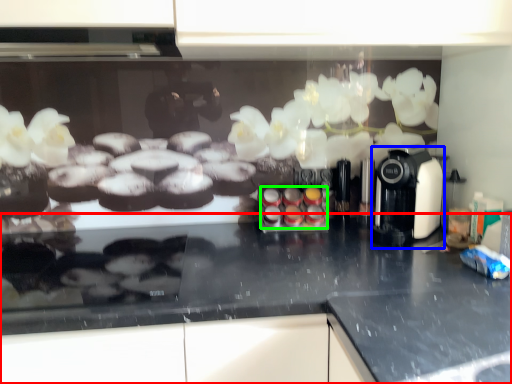
Question: Which object is the farthest from countertop (highlighted by a red box)? Choose among these: coffee machine (highlighted by a blue box) or food (highlighted by a green box).

Choices:
 (A) coffee machine
 (B) food

Answer: (B)